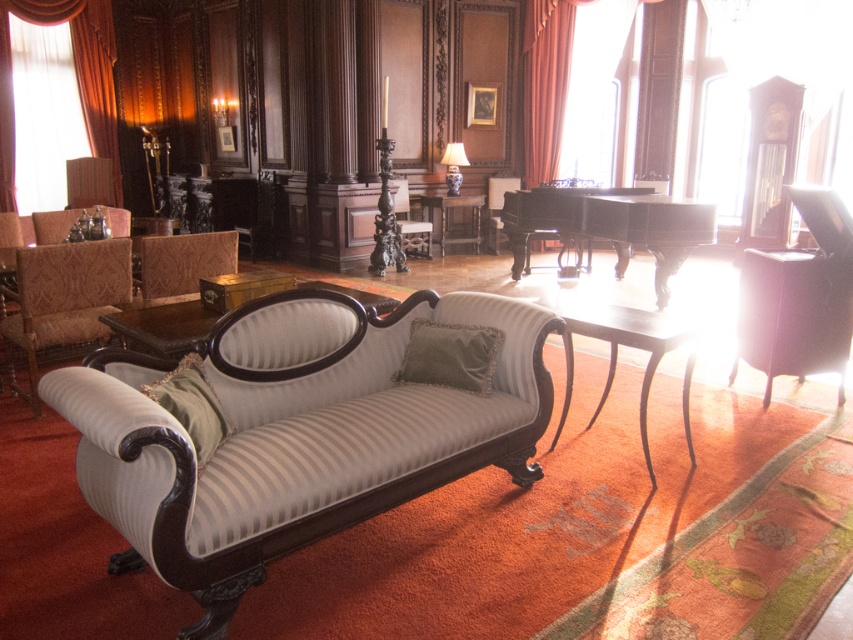
Question: Where is damask fabric armchair at left located in relation to patterned fabric armchair at left in the image?

Choices:
 (A) below
 (B) above

Answer: (A)

Question: Which object is the closest to the damask fabric armchair at left?

Choices:
 (A) striped fabric couch at center
 (B) wooden table at center
 (C) black wood side table at center
 (D) patterned fabric armchair at left

Answer: (D)

Question: Which of these objects is positioned closest to the green velvet pillow at center?

Choices:
 (A) velvet green pillow at center
 (B) silky orange curtain at left

Answer: (A)

Question: Does wooden table at center have a smaller size compared to velvet green armchair at center?

Choices:
 (A) yes
 (B) no

Answer: (B)

Question: From the image, what is the correct spatial relationship of damask fabric armchair at left in relation to silky orange curtain at left?

Choices:
 (A) right
 (B) left

Answer: (A)

Question: Which point is closer to the camera?

Choices:
 (A) velvet drapery at upper right
 (B) damask fabric armchair at left
 (C) wooden table at center
 (D) black polished wood piano at center

Answer: (B)